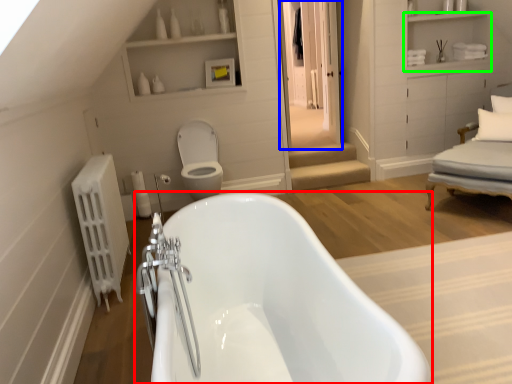
Question: Based on their relative distances, which object is farther from bathtub (highlighted by a red box)? Choose from glass door (highlighted by a blue box) and cabinet (highlighted by a green box).

Choices:
 (A) glass door
 (B) cabinet

Answer: (B)